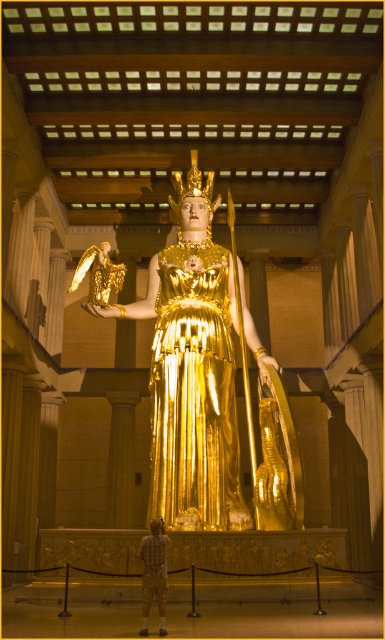
In the scene shown: Between gold metallic dress at center and plaid shirt at center, which one appears on the left side from the viewer's perspective?

From the viewer's perspective, plaid shirt at center appears more on the left side.

Find the location of a particular element. The width and height of the screenshot is (385, 640). gold metallic dress at center is located at coordinates (194, 394).

What do you see at coordinates (194, 369) in the screenshot? The image size is (385, 640). I see `gold reflective statue at center` at bounding box center [194, 369].

Between gold reflective statue at center and gold metallic dress at center, which one has more height?

gold reflective statue at center

Where is `gold reflective statue at center`? The height and width of the screenshot is (640, 385). gold reflective statue at center is located at coordinates (194, 369).

You are a GUI agent. You are given a task and a screenshot of the screen. Output one action in this format:
    pyautogui.click(x=<x>, y=<y>)
    Task: Click on the gold reflective statue at center
    
    Given the screenshot: What is the action you would take?
    pyautogui.click(x=194, y=369)

Is gold reflective statue at center to the right of plaid shirt at center from the viewer's perspective?

Indeed, gold reflective statue at center is positioned on the right side of plaid shirt at center.

Who is lower down, gold reflective statue at center or plaid shirt at center?

plaid shirt at center is lower down.

Is point (190, 406) positioned before point (165, 624)?

No, it is not.

Where is `gold reflective statue at center`? The height and width of the screenshot is (640, 385). gold reflective statue at center is located at coordinates (194, 369).